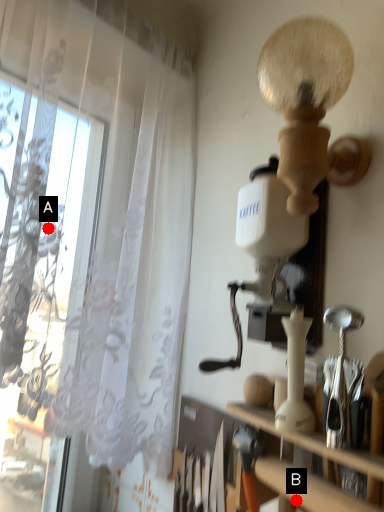
Question: Two points are circled on the image, labeled by A and B beside each circle. Which of the following is the farthest from the observer?

Choices:
 (A) A is further
 (B) B is further

Answer: (A)